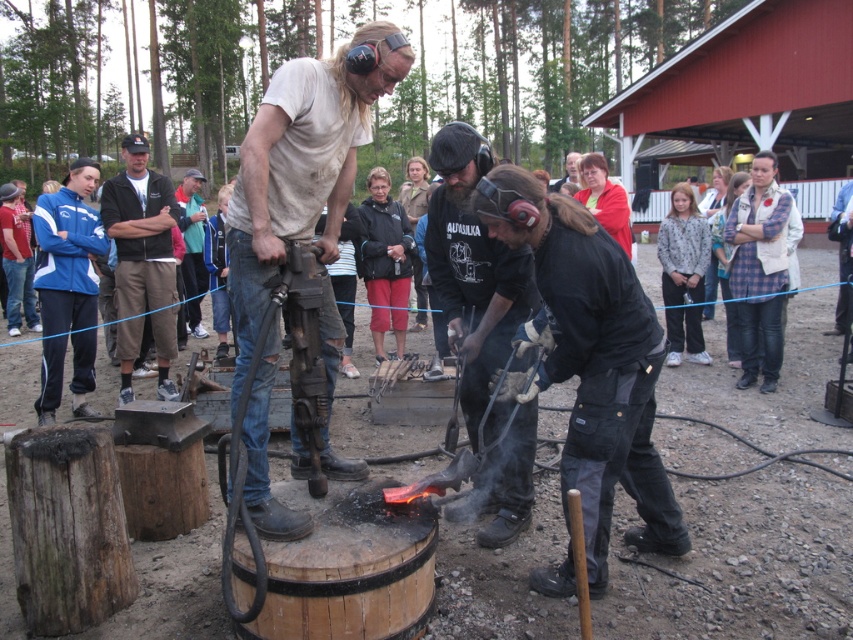
You are a photographer at the event and need to capture a photo of both the dirty white shirt at center and the black cotton jacket at upper left. Based on their heights, which one should you focus on first to ensure both are in frame?

The dirty white shirt at center has a lesser height compared to the black cotton jacket at upper left. Therefore, you should focus on the black cotton jacket at upper left first since it is taller and will occupy more space in the frame, ensuring both are visible.

You are a photographer at the event and want to capture a closeup of the dirty white shirt at center. What are the coordinates where you should focus your camera?

The coordinates to focus on are point [305,177].

You are a visitor at the blacksmithing demonstration and want to know where the black leather gloves at center are located relative to the black cotton jacket at upper left. Can you tell me their positions?

The black leather gloves at center are positioned under the black cotton jacket at upper left.